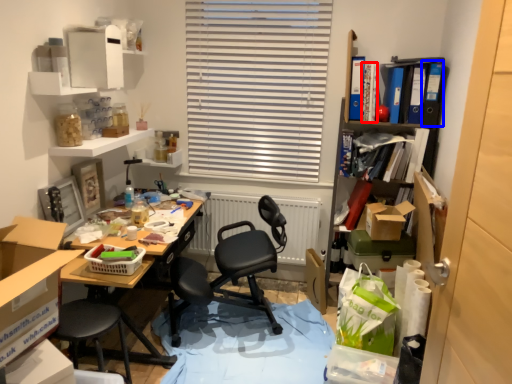
Question: Which of the following is the farthest to the observer, book (highlighted by a red box) or book (highlighted by a blue box)?

Choices:
 (A) book
 (B) book

Answer: (A)